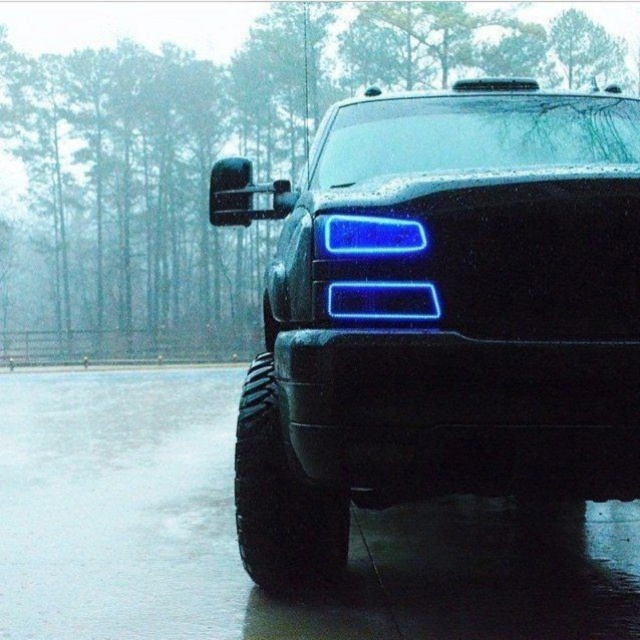
You are a mechanic inspecting the black pickup truck parked outside on a rainy day. You notice a point at coordinates [442,314]. What object is located at that point?

The point at coordinates [442,314] indicates the blue plastic headlights at center.